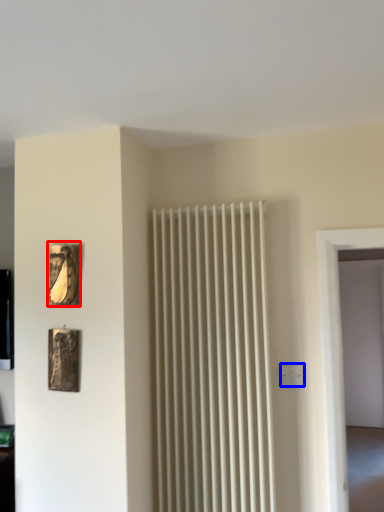
Question: Which of the following is the closest to the observer, picture frame (highlighted by a red box) or electric outlet (highlighted by a blue box)?

Choices:
 (A) picture frame
 (B) electric outlet

Answer: (A)